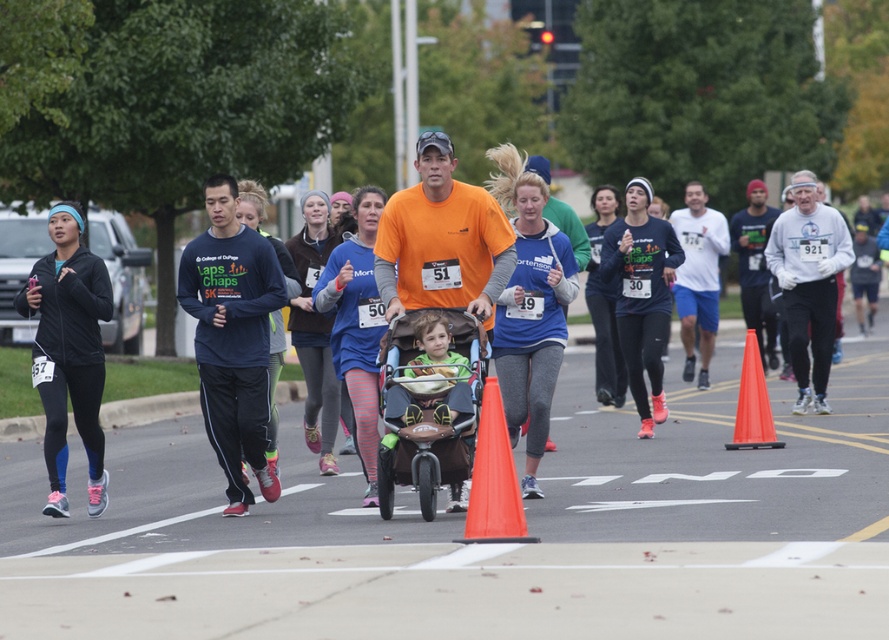
Does point (187, 284) lie behind point (414, 481)?

Yes, it is.

Can you confirm if dark blue long-sleeve shirt at left is wider than brown fabric stroller at center?

Correct, the width of dark blue long-sleeve shirt at left exceeds that of brown fabric stroller at center.

Does point (262, 310) come in front of point (422, 445)?

That is False.

Where is `dark blue long-sleeve shirt at left`? This screenshot has height=640, width=889. dark blue long-sleeve shirt at left is located at coordinates (231, 337).

Is dark blue long-sleeve shirt at left taller than orange plastic cone at center-right?

Yes.

Is dark blue long-sleeve shirt at left smaller than orange plastic cone at center-right?

Actually, dark blue long-sleeve shirt at left might be larger than orange plastic cone at center-right.

This screenshot has width=889, height=640. Describe the element at coordinates (231, 337) in the screenshot. I see `dark blue long-sleeve shirt at left` at that location.

I want to click on dark blue long-sleeve shirt at left, so click(x=231, y=337).

Does black matte running shoes at left have a greater width compared to orange plastic traffic cone at center?

Yes, black matte running shoes at left is wider than orange plastic traffic cone at center.

This screenshot has width=889, height=640. Describe the element at coordinates (69, 352) in the screenshot. I see `black matte running shoes at left` at that location.

In order to click on black matte running shoes at left in this screenshot , I will do `click(69, 352)`.